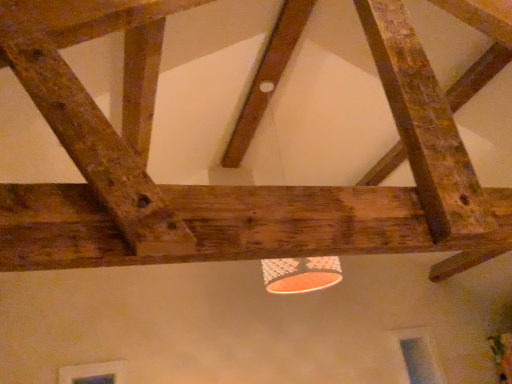
Question: Is rustic wood beam at upper right, marked as the 1th plank in a right-to-left arrangement, facing towards rustic wood beam at center, the 3th plank in the front-to-back sequence?

Choices:
 (A) no
 (B) yes

Answer: (A)

Question: Considering the relative positions of rustic wood beam at upper right, the second plank viewed from the back, and rustic wood beam at center, the 2th plank positioned from the left, in the image provided, is rustic wood beam at upper right, the second plank viewed from the back, to the left of rustic wood beam at center, the 2th plank positioned from the left, from the viewer's perspective?

Choices:
 (A) no
 (B) yes

Answer: (A)

Question: Considering the relative positions of rustic wood beam at upper right, acting as the 2th plank starting from the front, and rustic wood beam at center, acting as the 1th plank starting from the back, in the image provided, is rustic wood beam at upper right, acting as the 2th plank starting from the front, to the right of rustic wood beam at center, acting as the 1th plank starting from the back, from the viewer's perspective?

Choices:
 (A) no
 (B) yes

Answer: (B)

Question: Is rustic wood beam at upper right, acting as the 2th plank starting from the front, placed right next to rustic wood beam at center, the second plank viewed from the right?

Choices:
 (A) yes
 (B) no

Answer: (B)

Question: Is rustic wood beam at center, the 3th plank in the front-to-back sequence, located within rustic wood beam at upper right, positioned as the 3th plank in left-to-right order?

Choices:
 (A) no
 (B) yes

Answer: (A)

Question: Is rustic wood beam at center, the second plank viewed from the right, in front of or behind rustic wood beam at upper right, the second plank viewed from the back, in the image?

Choices:
 (A) behind
 (B) front

Answer: (A)

Question: In terms of size, does rustic wood beam at center, acting as the 1th plank starting from the back, appear bigger or smaller than rustic wood beam at upper right, positioned as the 3th plank in left-to-right order?

Choices:
 (A) big
 (B) small

Answer: (A)

Question: In the image, is rustic wood beam at center, the 3th plank in the front-to-back sequence, on the left side or the right side of rustic wood beam at upper right, marked as the 1th plank in a right-to-left arrangement?

Choices:
 (A) left
 (B) right

Answer: (A)

Question: Considering the positions of rustic wood beam at center, acting as the 1th plank starting from the back, and rustic wood beam at upper right, acting as the 2th plank starting from the front, in the image, is rustic wood beam at center, acting as the 1th plank starting from the back, taller or shorter than rustic wood beam at upper right, acting as the 2th plank starting from the front,?

Choices:
 (A) tall
 (B) short

Answer: (B)

Question: From the image's perspective, is rustic wood beam at upper right, acting as the 2th plank starting from the front, above or below rustic wood beam at center, acting as the 1th plank starting from the back?

Choices:
 (A) below
 (B) above

Answer: (A)

Question: In terms of width, does rustic wood beam at upper right, acting as the 2th plank starting from the front, look wider or thinner when compared to rustic wood beam at center, the second plank viewed from the right?

Choices:
 (A) thin
 (B) wide

Answer: (A)

Question: From a real-world perspective, is rustic wood beam at upper right, acting as the 2th plank starting from the front, positioned above or below rustic wood beam at center, the 3th plank in the front-to-back sequence?

Choices:
 (A) above
 (B) below

Answer: (B)

Question: Based on their sizes in the image, would you say rustic wood beam at upper right, the second plank viewed from the back, is bigger or smaller than rustic wood beam at center, the second plank viewed from the right?

Choices:
 (A) small
 (B) big

Answer: (A)

Question: Is rustic wood beam at upper right, the second plank viewed from the back, bigger or smaller than rustic wood beam at upper center, the first plank positioned from the front?

Choices:
 (A) small
 (B) big

Answer: (A)

Question: From a real-world perspective, is rustic wood beam at upper right, the second plank viewed from the back, positioned above or below rustic wood beam at upper center, which is the first plank in left-to-right order?

Choices:
 (A) above
 (B) below

Answer: (A)